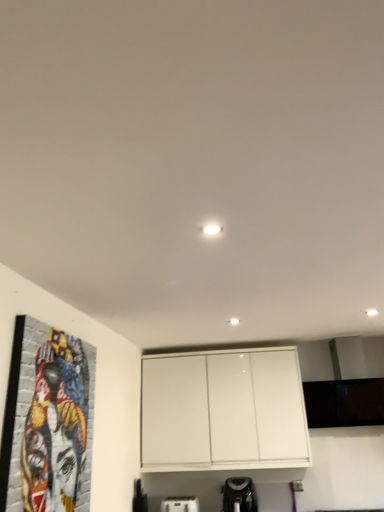
Question: From a real-world perspective, is black plastic coffee maker at lower center, marked as the first appliance in a right-to-left arrangement, below white glossy cabinet at upper center?

Choices:
 (A) yes
 (B) no

Answer: (A)

Question: Considering the relative sizes of black plastic coffee maker at lower center, marked as the first appliance in a right-to-left arrangement, and white glossy cabinet at upper center in the image provided, is black plastic coffee maker at lower center, marked as the first appliance in a right-to-left arrangement, smaller than white glossy cabinet at upper center?

Choices:
 (A) yes
 (B) no

Answer: (A)

Question: Can you confirm if black plastic coffee maker at lower center, the second appliance viewed from the left, is bigger than white glossy cabinet at upper center?

Choices:
 (A) no
 (B) yes

Answer: (A)

Question: Does black plastic coffee maker at lower center, the second appliance viewed from the left, have a lesser width compared to white glossy cabinet at upper center?

Choices:
 (A) yes
 (B) no

Answer: (A)

Question: Is white glossy cabinet at upper center completely or partially inside black plastic coffee maker at lower center, marked as the first appliance in a right-to-left arrangement?

Choices:
 (A) yes
 (B) no

Answer: (B)

Question: Does black plastic coffee maker at lower center, the second appliance viewed from the left, lie behind white glossy cabinet at upper center?

Choices:
 (A) no
 (B) yes

Answer: (A)

Question: From a real-world perspective, is white glossy cabinet at upper center on colorful mosaic portrait at left?

Choices:
 (A) yes
 (B) no

Answer: (A)

Question: Is white glossy cabinet at upper center taller than colorful mosaic portrait at left?

Choices:
 (A) no
 (B) yes

Answer: (B)

Question: Is white glossy cabinet at upper center further to camera compared to colorful mosaic portrait at left?

Choices:
 (A) yes
 (B) no

Answer: (A)

Question: Is white glossy cabinet at upper center directly adjacent to colorful mosaic portrait at left?

Choices:
 (A) no
 (B) yes

Answer: (A)

Question: From a real-world perspective, is white glossy cabinet at upper center beneath colorful mosaic portrait at left?

Choices:
 (A) no
 (B) yes

Answer: (A)

Question: Can you confirm if white glossy cabinet at upper center is thinner than colorful mosaic portrait at left?

Choices:
 (A) no
 (B) yes

Answer: (A)

Question: From the image's perspective, is black plastic coffee maker at lower center, the second appliance viewed from the left, on top of white plastic toaster at lower center, the first appliance when ordered from left to right?

Choices:
 (A) yes
 (B) no

Answer: (A)